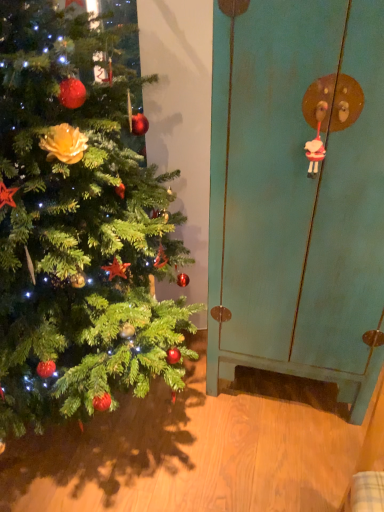
Question: Should I look upward or downward to see green matte christmas tree at left?

Choices:
 (A) up
 (B) down

Answer: (A)

Question: Does white glossy sheep at upper right appear on the left side of green matte christmas tree at left?

Choices:
 (A) no
 (B) yes

Answer: (A)

Question: Would you consider white glossy sheep at upper right to be distant from green matte christmas tree at left?

Choices:
 (A) yes
 (B) no

Answer: (B)

Question: From the image's perspective, would you say white glossy sheep at upper right is positioned over green matte christmas tree at left?

Choices:
 (A) no
 (B) yes

Answer: (B)

Question: Is white glossy sheep at upper right closer to camera compared to green matte christmas tree at left?

Choices:
 (A) yes
 (B) no

Answer: (B)

Question: From a real-world perspective, is white glossy sheep at upper right positioned under green matte christmas tree at left based on gravity?

Choices:
 (A) no
 (B) yes

Answer: (A)

Question: Is white glossy sheep at upper right surrounding green matte christmas tree at left?

Choices:
 (A) yes
 (B) no

Answer: (B)

Question: Is teal matte cabinet at right wider than white glossy sheep at upper right?

Choices:
 (A) yes
 (B) no

Answer: (A)

Question: Considering the relative sizes of teal matte cabinet at right and white glossy sheep at upper right in the image provided, is teal matte cabinet at right shorter than white glossy sheep at upper right?

Choices:
 (A) yes
 (B) no

Answer: (B)

Question: Does teal matte cabinet at right have a lesser width compared to white glossy sheep at upper right?

Choices:
 (A) yes
 (B) no

Answer: (B)

Question: Is teal matte cabinet at right facing towards white glossy sheep at upper right?

Choices:
 (A) yes
 (B) no

Answer: (A)

Question: Is teal matte cabinet at right smaller than white glossy sheep at upper right?

Choices:
 (A) yes
 (B) no

Answer: (B)

Question: Is teal matte cabinet at right next to white glossy sheep at upper right?

Choices:
 (A) yes
 (B) no

Answer: (B)

Question: From the image's perspective, is green matte christmas tree at left on top of teal matte cabinet at right?

Choices:
 (A) no
 (B) yes

Answer: (A)